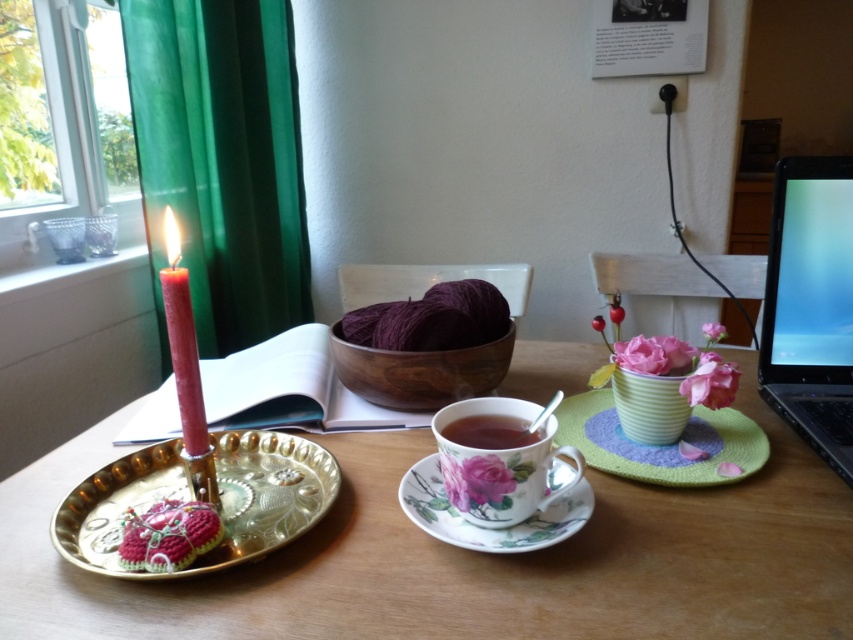
You are standing in the room and want to reach the window to adjust the green fabric curtain at left. Based on the coordinates provided, is the curtain closer to the top or bottom of the window?

The green fabric curtain at left is located at point coordinates with a y value of 0.260, which places it closer to the bottom of the window since lower y values typically indicate lower positions in such coordinate systems.

You are organizing a tea party and need to place the porcelain floral teacup at center and the crochet fabric at center on a small table. Given their sizes, which item should you place first to ensure both fit comfortably?

The porcelain floral teacup at center is wider than the crochet fabric at center. You should place the larger item, the porcelain floral teacup at center, first to ensure both fit comfortably on the table.